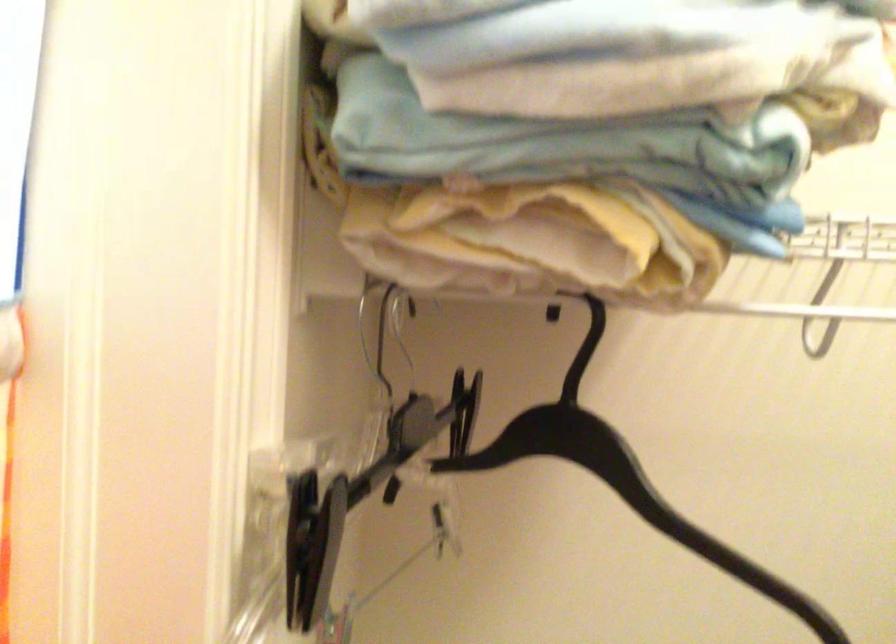
The width and height of the screenshot is (896, 644). What do you see at coordinates (362, 488) in the screenshot? I see `a black hanger clip` at bounding box center [362, 488].